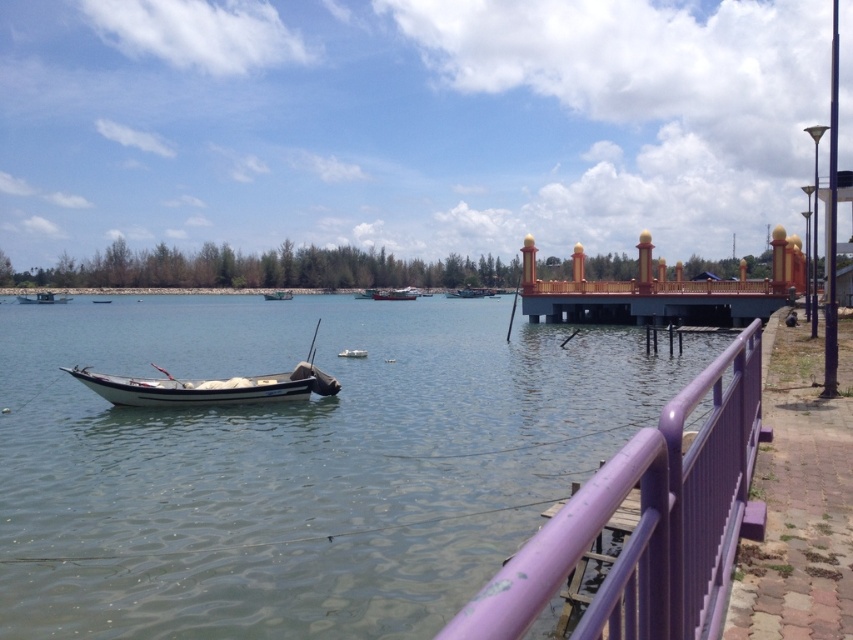
Who is shorter, white plastic boat at lower left or white matte boat at left?

white matte boat at left

Can you confirm if white plastic boat at lower left is shorter than white matte boat at left?

No.

Describe the element at coordinates (42, 298) in the screenshot. The image size is (853, 640). I see `white plastic boat at lower left` at that location.

Image resolution: width=853 pixels, height=640 pixels. I want to click on white plastic boat at lower left, so click(x=42, y=298).

Between purple painted metal railing at lower right and white matte boat at center, which one has less height?

white matte boat at center

Is point (647, 444) positioned behind point (354, 356)?

No, it is in front of (354, 356).

The image size is (853, 640). Describe the element at coordinates (648, 522) in the screenshot. I see `purple painted metal railing at lower right` at that location.

Find the location of a particular element. purple painted metal railing at lower right is located at coordinates 648,522.

Does metallic gray boat at center appear on the right side of wooden boat at center?

In fact, metallic gray boat at center is to the left of wooden boat at center.

Is metallic gray boat at center above wooden boat at center?

No, metallic gray boat at center is not above wooden boat at center.

Is point (387, 298) behind point (456, 292)?

No.

I want to click on metallic gray boat at center, so click(395, 294).